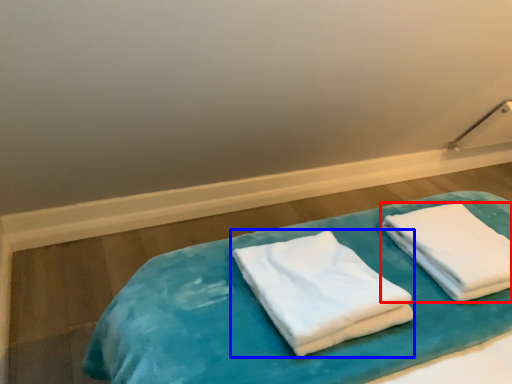
Question: Among these objects, which one is farthest to the camera, towel (highlighted by a red box) or towel (highlighted by a blue box)?

Choices:
 (A) towel
 (B) towel

Answer: (A)